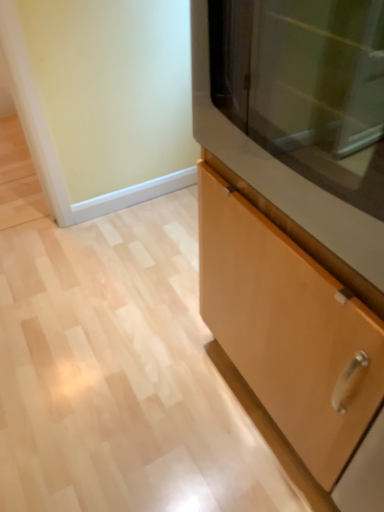
Question: From the image's perspective, is light wood cabinet at center above or below matte brown cabinet at right?

Choices:
 (A) below
 (B) above

Answer: (A)

Question: Is point (286, 397) closer or farther from the camera than point (365, 240)?

Choices:
 (A) farther
 (B) closer

Answer: (A)

Question: In the image, is light wood cabinet at center on the left side or the right side of matte brown cabinet at right?

Choices:
 (A) left
 (B) right

Answer: (B)

Question: Is point (220, 132) positioned closer to the camera than point (340, 459)?

Choices:
 (A) closer
 (B) farther

Answer: (A)

Question: Is matte brown cabinet at right in front of or behind light wood cabinet at center in the image?

Choices:
 (A) front
 (B) behind

Answer: (B)

Question: Is matte brown cabinet at right bigger or smaller than light wood cabinet at center?

Choices:
 (A) big
 (B) small

Answer: (B)

Question: Looking at their shapes, would you say matte brown cabinet at right is wider or thinner than light wood cabinet at center?

Choices:
 (A) thin
 (B) wide

Answer: (B)